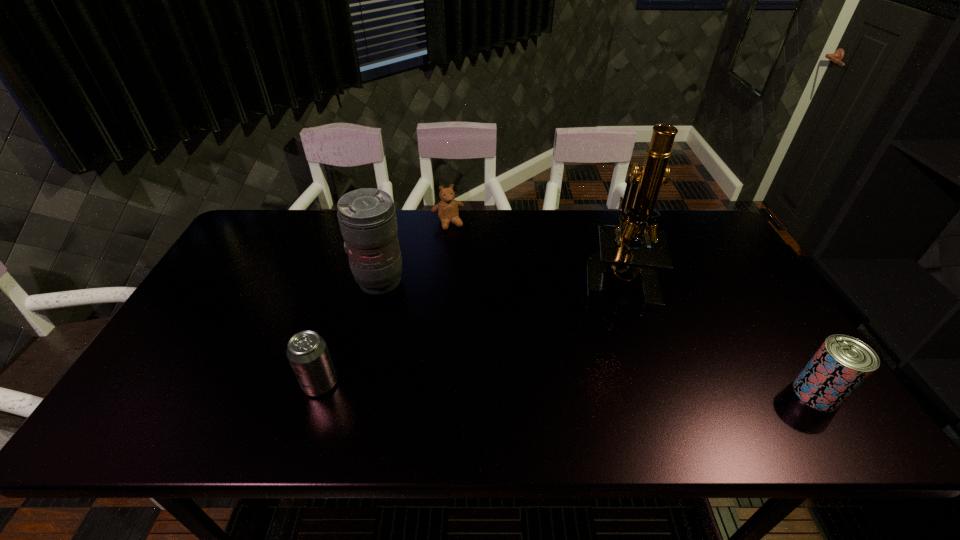
I want to click on vacant area in the image that satisfies the following two spatial constraints: 1. on the front side of the third object from right to left; 2. on the left side of the rightmost object, so click(x=432, y=394).

In order to click on free space that satisfies the following two spatial constraints: 1. on the back side of the fourth shortest object; 2. on the right side of the left beer can in this screenshot , I will do `click(352, 281)`.

Locate an element on the screen. The image size is (960, 540). vacant area in the image that satisfies the following two spatial constraints: 1. on the front side of the telephoto lens; 2. on the left side of the right beer can is located at coordinates (351, 394).